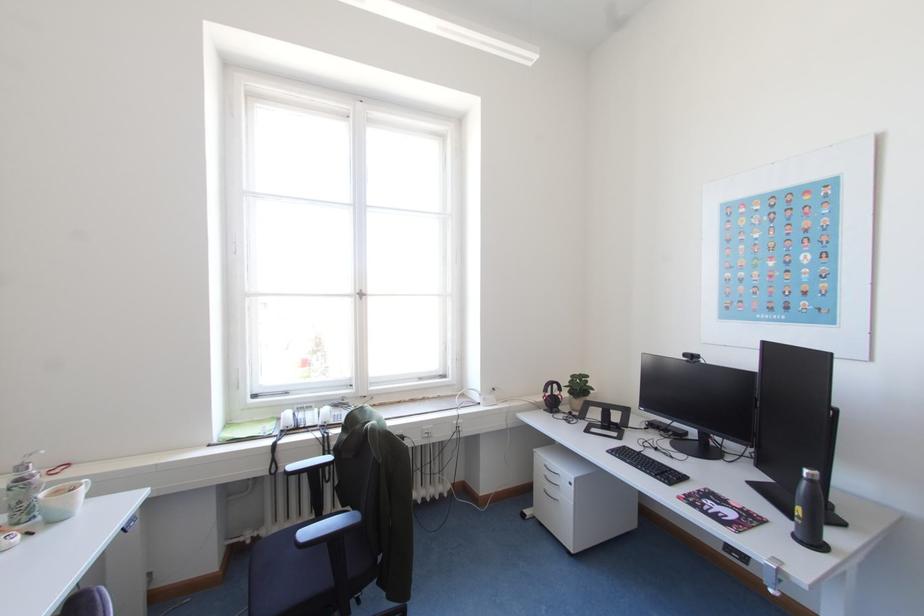
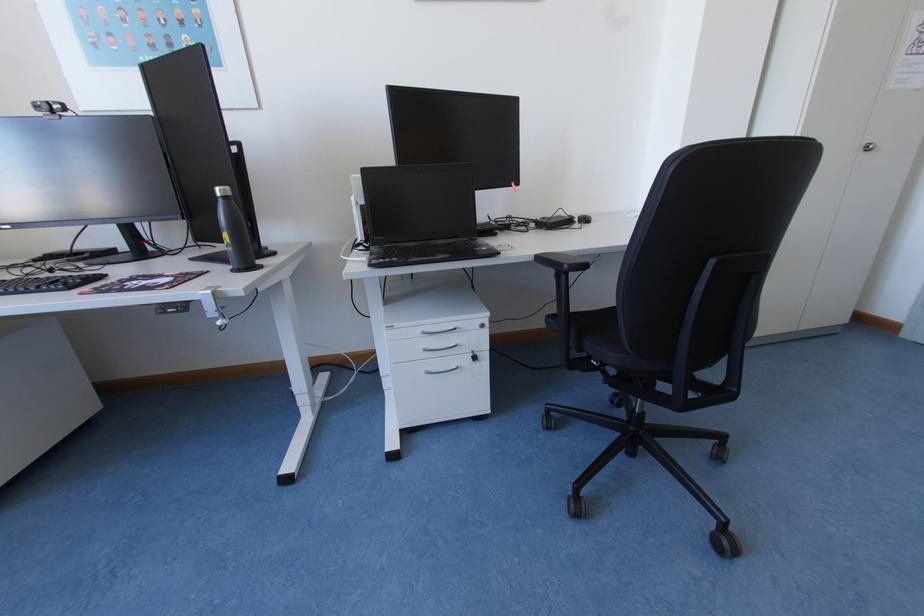
The first image is from the beginning of the video and the second image is from the end. How did the camera likely rotate when shooting the video?

The rotation direction of the camera is right-down.